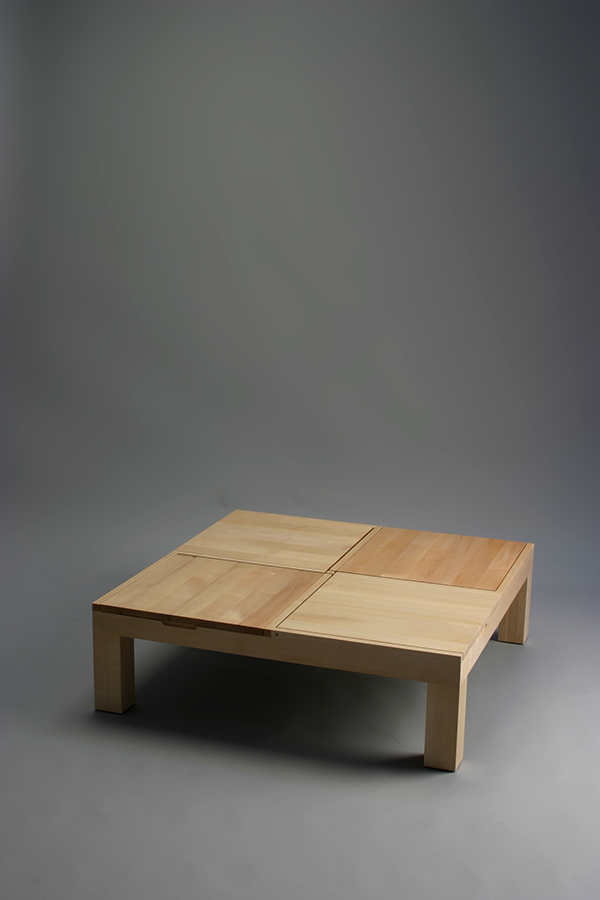
Image resolution: width=600 pixels, height=900 pixels. What are the coordinates of `grey floor` in the screenshot? It's located at (326, 840).